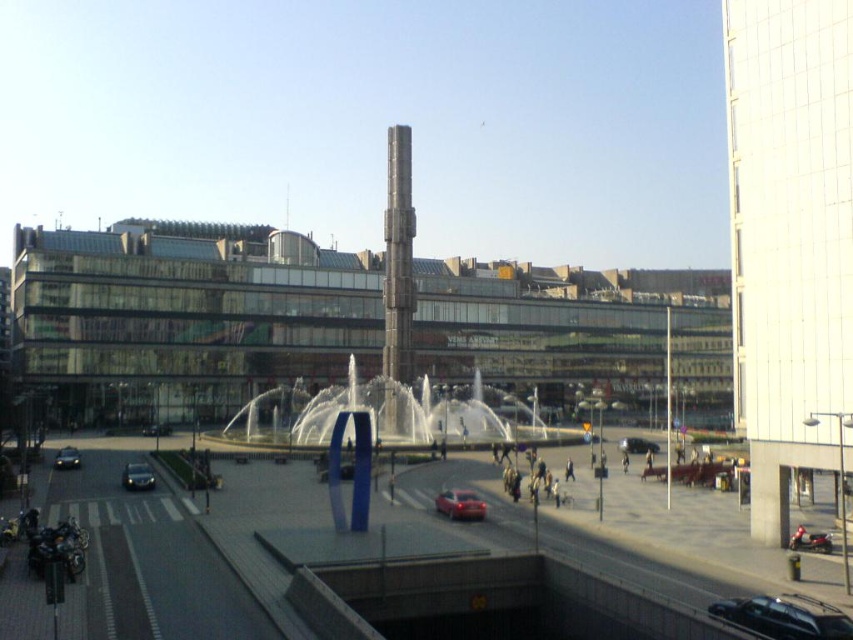
Does shiny red car at center appear on the right side of shiny chrome motorcycle at lower right?

No, shiny red car at center is not to the right of shiny chrome motorcycle at lower right.

Is shiny red car at center below shiny chrome motorcycle at lower right?

Yes, shiny red car at center is below shiny chrome motorcycle at lower right.

This screenshot has width=853, height=640. What are the coordinates of `shiny red car at center` in the screenshot? It's located at (460, 504).

Does shiny red car at center appear on the left side of shiny black car at lower left?

No, shiny red car at center is not to the left of shiny black car at lower left.

Which is more to the left, shiny red car at center or shiny black car at lower left?

shiny black car at lower left is more to the left.

What do you see at coordinates (460, 504) in the screenshot? The width and height of the screenshot is (853, 640). I see `shiny red car at center` at bounding box center [460, 504].

I want to click on shiny red car at center, so click(460, 504).

Does clear glass water at center appear on the left side of shiny black car at center?

Incorrect, clear glass water at center is not on the left side of shiny black car at center.

Who is more distant from viewer, (426,420) or (143,433)?

The point (143,433) is behind.

You are a GUI agent. You are given a task and a screenshot of the screen. Output one action in this format:
    pyautogui.click(x=<x>, y=<y>)
    Task: Click on the clear glass water at center
    Image resolution: width=853 pixels, height=640 pixels.
    Given the screenshot: What is the action you would take?
    pyautogui.click(x=392, y=416)